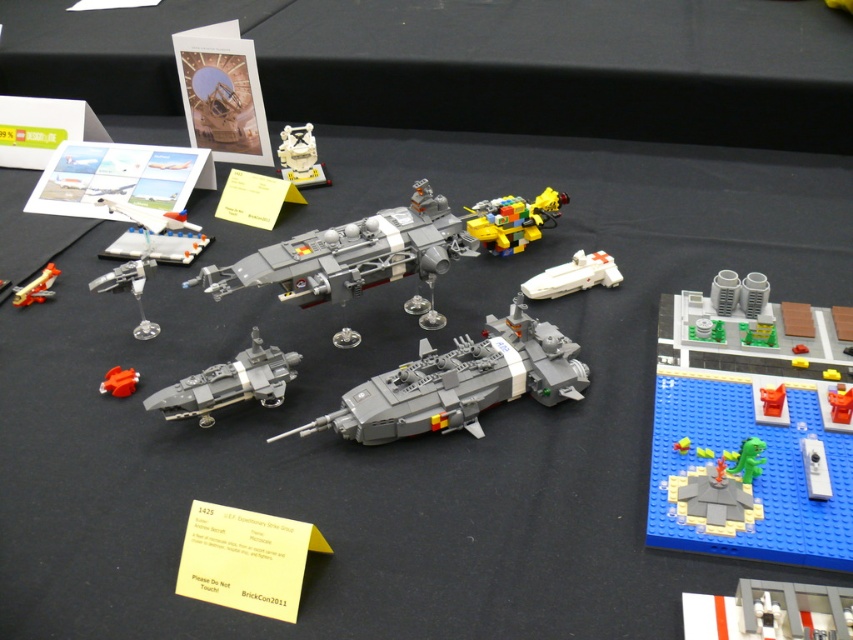
Question: Observing the image, what is the correct spatial positioning of matte orange brick at center in reference to orange plastic toy at center?

Choices:
 (A) below
 (B) above

Answer: (B)

Question: Can you confirm if white plastic spaceship at center-right is positioned to the right of matte silver spaceship at lower left?

Choices:
 (A) yes
 (B) no

Answer: (A)

Question: Among these objects, which one is farthest from the camera?

Choices:
 (A) white plastic toy at upper center
 (B) green matte dinosaur at center
 (C) gray matte/rough spaceship at center
 (D) white plastic spaceship at center-right

Answer: (A)

Question: Can you confirm if matte gray spaceship at center is positioned to the right of yellow plastic robot at center?

Choices:
 (A) yes
 (B) no

Answer: (B)

Question: Which object appears closest to the camera in this image?

Choices:
 (A) metallic gold airplane at left
 (B) bright yellow plastic duck at center

Answer: (B)

Question: Which point appears farthest from the camera in this image?

Choices:
 (A) (289, 356)
 (B) (300, 173)
 (C) (828, 589)

Answer: (B)